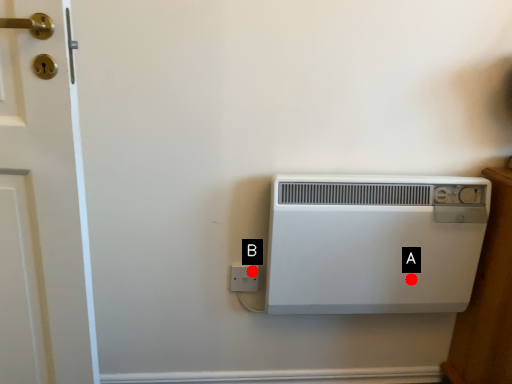
Question: Two points are circled on the image, labeled by A and B beside each circle. Which point is closer to the camera?

Choices:
 (A) A is closer
 (B) B is closer

Answer: (A)